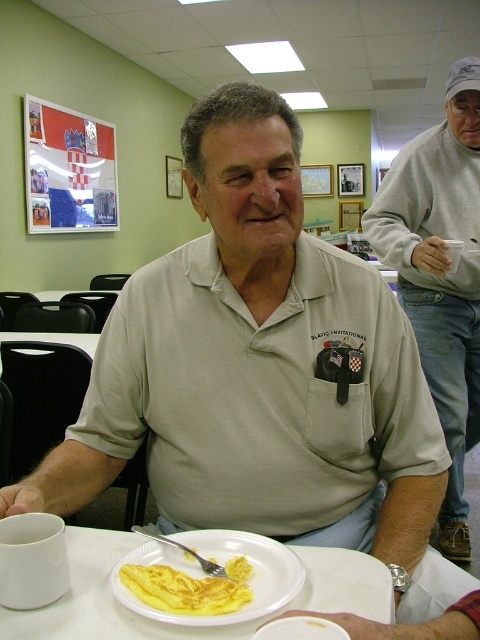
You are a photographer taking a picture of the beige cotton shirt at center and the white paper plate at lower center. Which object will appear larger in your photo?

The beige cotton shirt at center will appear larger in the photo because it is closer to the viewer than the white paper plate at lower center.

You are a photographer adjusting your camera settings to capture the man at the white table. You notice two points in the scene labeled as point (267, 614) and point (139, 529). Which of these points will appear larger in your photo?

Point (267, 614) is closer to the camera than point (139, 529), so it will appear larger in the photo.

What are the coordinates of the beige cotton shirt at center in the image?

The beige cotton shirt at center is located at coordinates point [441,273].